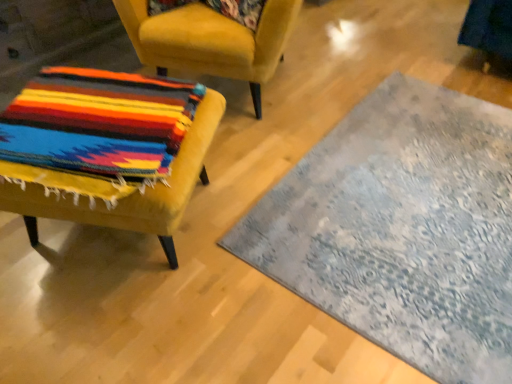
Question: Is floral fabric pillow at upper center not near multicolored woven fabric at left, the 1th chair in the top-to-bottom sequence?

Choices:
 (A) no
 (B) yes

Answer: (A)

Question: Is floral fabric pillow at upper center shorter than multicolored woven fabric at left, the 1th chair in the top-to-bottom sequence?

Choices:
 (A) no
 (B) yes

Answer: (B)

Question: Can you confirm if floral fabric pillow at upper center is taller than multicolored woven fabric at left, the 1th chair in the top-to-bottom sequence?

Choices:
 (A) yes
 (B) no

Answer: (B)

Question: Is floral fabric pillow at upper center bigger than multicolored woven fabric at left, the 2th chair positioned from the bottom?

Choices:
 (A) yes
 (B) no

Answer: (B)

Question: Are floral fabric pillow at upper center and multicolored woven fabric at left, the 2th chair positioned from the bottom, beside each other?

Choices:
 (A) no
 (B) yes

Answer: (A)

Question: From a real-world perspective, is floral fabric pillow at upper center located higher than multicolored woven fabric at left, the 2th chair positioned from the bottom?

Choices:
 (A) yes
 (B) no

Answer: (A)

Question: Is multicolored woven fabric at left, the 1th chair in the top-to-bottom sequence, smaller than textured gray rug at center?

Choices:
 (A) no
 (B) yes

Answer: (A)

Question: Considering the relative positions of multicolored woven fabric at left, the 1th chair in the top-to-bottom sequence, and textured gray rug at center in the image provided, is multicolored woven fabric at left, the 1th chair in the top-to-bottom sequence, in front of textured gray rug at center?

Choices:
 (A) no
 (B) yes

Answer: (A)

Question: Are multicolored woven fabric at left, the 1th chair in the top-to-bottom sequence, and textured gray rug at center far apart?

Choices:
 (A) yes
 (B) no

Answer: (B)

Question: Is multicolored woven fabric at left, the 1th chair in the top-to-bottom sequence, turned away from textured gray rug at center?

Choices:
 (A) yes
 (B) no

Answer: (B)

Question: Could you tell me if multicolored woven fabric at left, the 1th chair in the top-to-bottom sequence, is facing textured gray rug at center?

Choices:
 (A) yes
 (B) no

Answer: (B)

Question: Is multicolored woven fabric at left, the 2th chair positioned from the bottom, completely or partially outside of textured gray rug at center?

Choices:
 (A) yes
 (B) no

Answer: (A)

Question: Is velvet yellow chair at left, the 2th chair when ordered from top to bottom, to the left of multicolored woven fabric at left, the 1th chair in the top-to-bottom sequence, from the viewer's perspective?

Choices:
 (A) yes
 (B) no

Answer: (A)